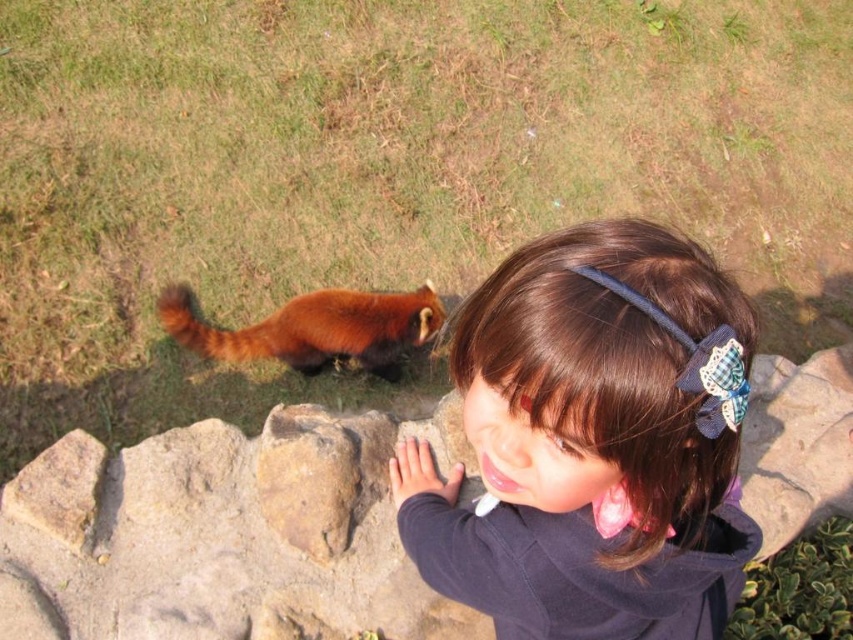
Looking at this image, you are a photographer trying to capture a closeup of the brown hair at upper right and the brown rough stone at lower center in the scene. Since you want both objects to appear similarly sized in the photo, which object should you move closer to the camera?

Since the brown hair at upper right is narrower than the brown rough stone at lower center, you should move the brown rough stone at lower center closer to the camera to make them appear the same size in the photo.

You are a photographer trying to capture a clear photo of the brown hair at upper right and the brown rough stone at lower center. Which object should you focus on first if you want to ensure both are in focus without adjusting the camera settings?

The brown hair at upper right is taller than the brown rough stone at lower center. To ensure both are in focus, focus on the brown rough stone at lower center first since it is closer to the camera. This way, the depth of field will extend to the taller object.